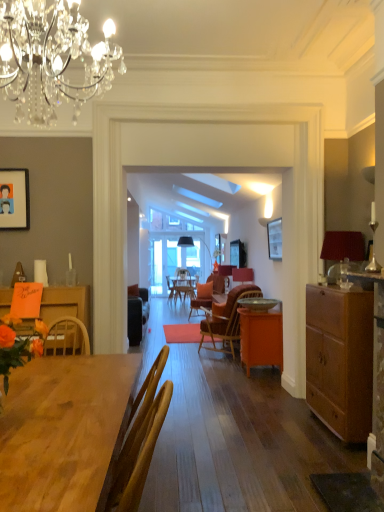
Question: Is matte orange flowers at left bigger or smaller than crystal chandelier at upper center, the first lamp in the front-to-back sequence?

Choices:
 (A) small
 (B) big

Answer: (A)

Question: From a real-world perspective, is matte orange flowers at left above or below crystal chandelier at upper center, the second lamp viewed from the back?

Choices:
 (A) below
 (B) above

Answer: (A)

Question: Based on their relative distances, which object is nearer to the red fabric lampshade at center?

Choices:
 (A) orange matte cabinet at center
 (B) metallic gold bowl at center
 (C) red velvet lampshade at right, placed as the second lamp when sorted from front to back
 (D) wooden table at lower left
 (E) matte orange flowers at left

Answer: (B)

Question: Considering the real-world distances, which object is farthest from the red fabric lampshade at center?

Choices:
 (A) white glossy picture frame at upper center
 (B) wooden chair at center
 (C) wooden table at lower left
 (D) matte orange flowers at left
 (E) dark brown wood cabinet at right

Answer: (C)